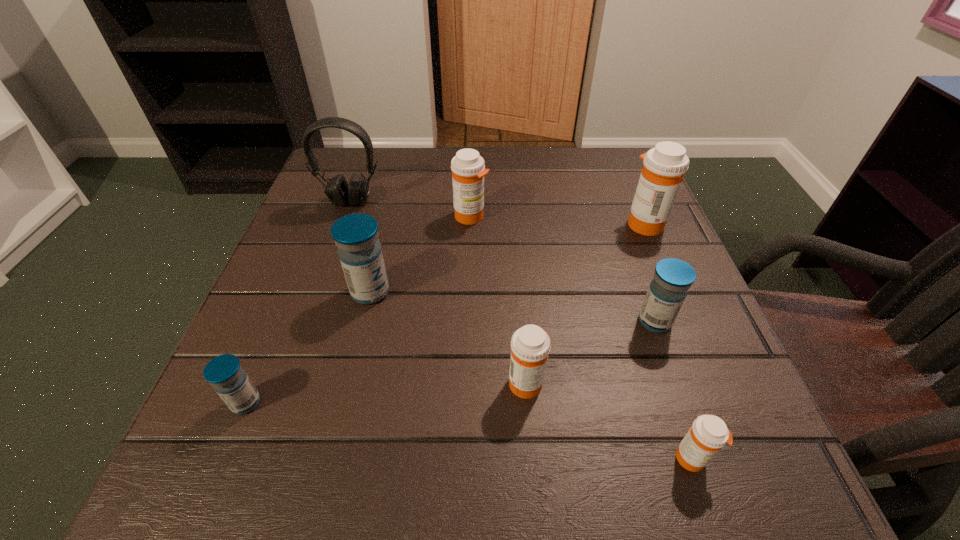
In order to click on vacant area located on the left of the rightmost blue medicine in this screenshot , I will do point(468,321).

Where is `free space located on the right of the leftmost blue medicine`? The width and height of the screenshot is (960, 540). free space located on the right of the leftmost blue medicine is located at coordinates (384, 403).

This screenshot has width=960, height=540. What are the coordinates of `free space located 0.140m on the left of the third orange medicine from left to right` in the screenshot? It's located at (570, 458).

Where is `object that is positioned at the far edge`? The height and width of the screenshot is (540, 960). object that is positioned at the far edge is located at coordinates tap(339, 192).

Locate an element on the screen. object present at the near edge is located at coordinates (708, 434).

Find the location of a particular element. The height and width of the screenshot is (540, 960). headset present at the left edge is located at coordinates (339, 192).

This screenshot has height=540, width=960. In order to click on object present at the far left corner in this screenshot , I will do `click(339, 192)`.

Where is `object present at the near right corner`? object present at the near right corner is located at coordinates (708, 434).

Identify the location of blank space at the far edge. (552, 186).

Identify the location of blank space at the near edge of the desktop. point(649,497).